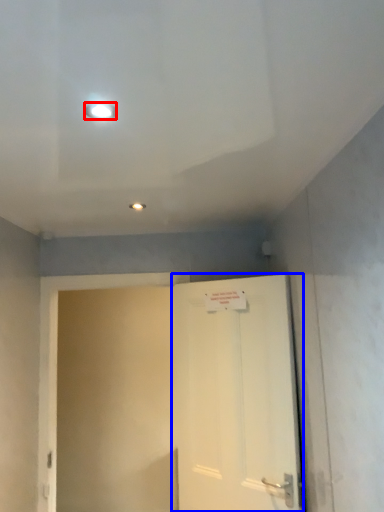
Question: Among these objects, which one is nearest to the camera, lighting (highlighted by a red box) or door (highlighted by a blue box)?

Choices:
 (A) lighting
 (B) door

Answer: (A)